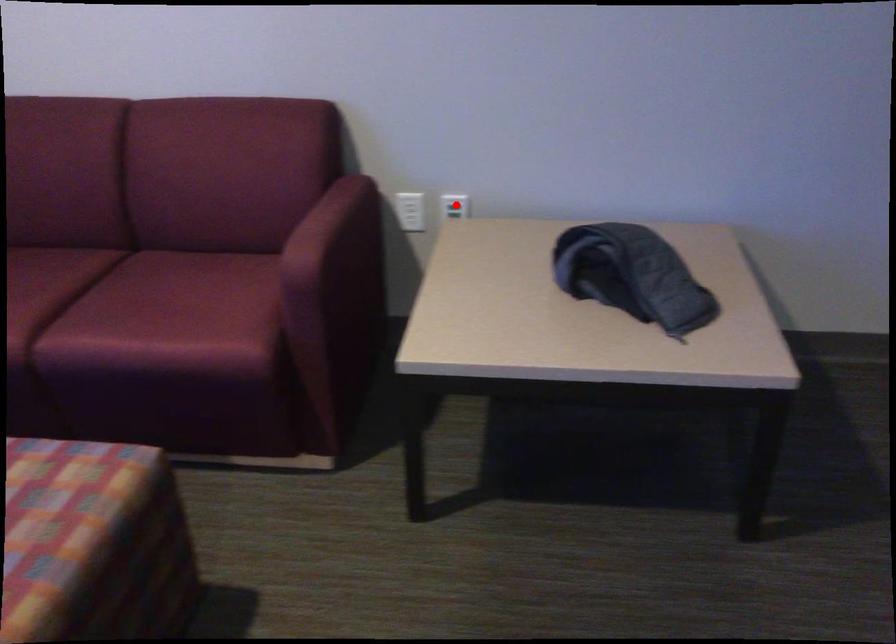
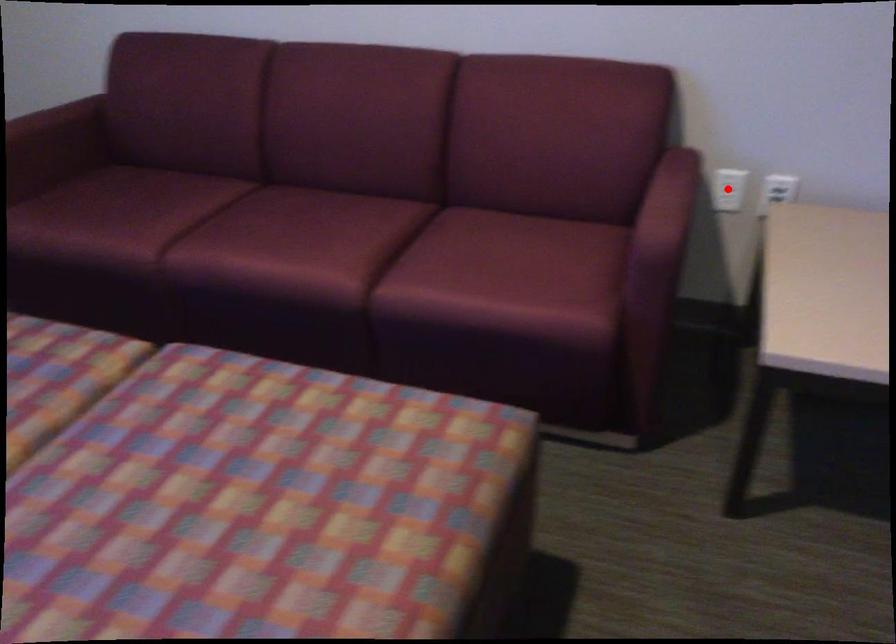
From the picture: I am providing you with two images of the same scene from different viewpoints. A red point is marked on the first image and another point is marked on the second image. Are the points marked in image1 and image2 representing the same 3D position?

No